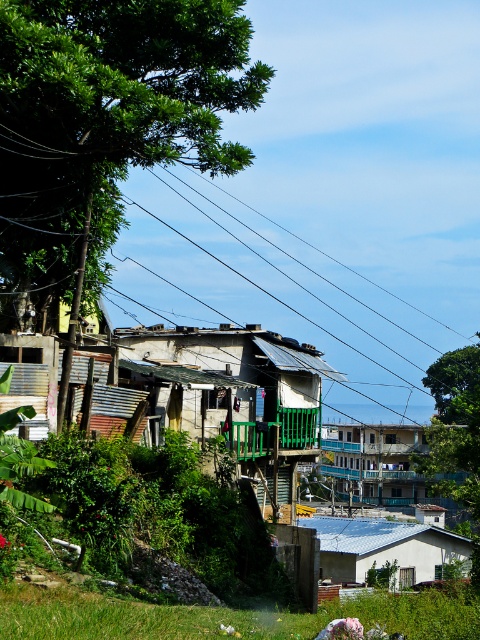
Is black wire at upper center in front of blue painted wood balcony at center?

No, it is behind blue painted wood balcony at center.

Does point (208, 236) come in front of point (360, 481)?

No, (208, 236) is behind (360, 481).

Find the location of a particular element. black wire at upper center is located at coordinates (277, 282).

Is point (224, 326) in front of point (370, 484)?

Yes.

Can you confirm if rusty corrugated metal hut at center is thinner than blue painted wood balcony at center?

Correct, rusty corrugated metal hut at center's width is less than blue painted wood balcony at center's.

What do you see at coordinates (235, 388) in the screenshot? I see `rusty corrugated metal hut at center` at bounding box center [235, 388].

This screenshot has width=480, height=640. I want to click on rusty corrugated metal hut at center, so click(235, 388).

Who is taller, green leafy tree at upper left or green leafy tree at upper center?

Standing taller between the two is green leafy tree at upper center.

Locate an element on the screen. The image size is (480, 640). green leafy tree at upper left is located at coordinates (106, 120).

Identify the location of green leafy tree at upper left. (106, 120).

You are a GUI agent. You are given a task and a screenshot of the screen. Output one action in this format:
    pyautogui.click(x=<x>, y=<y>)
    Task: Click on the green leafy tree at upper left
    
    Given the screenshot: What is the action you would take?
    pyautogui.click(x=106, y=120)